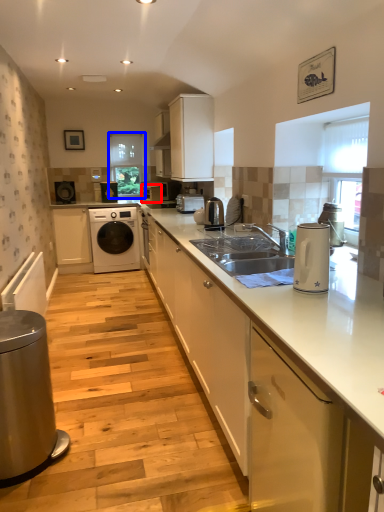
Question: Which of the following is the farthest to the observer, appliance (highlighted by a red box) or window screen (highlighted by a blue box)?

Choices:
 (A) appliance
 (B) window screen

Answer: (B)